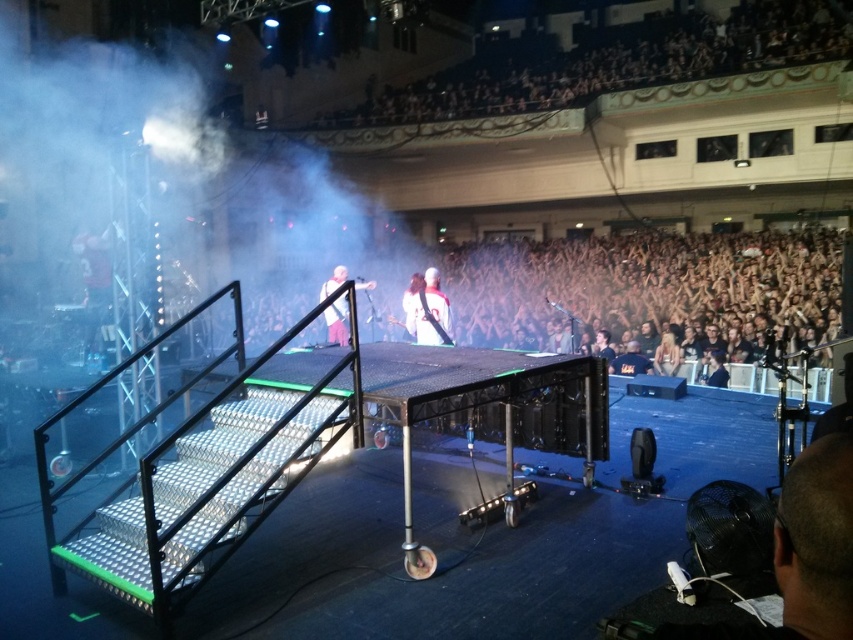
You are a stagehand at the concert and need to position a new spotlight. The spotlight needs to be placed at the exact center of the stage. You have coordinates for a point on the stage. Is the point at (97, 152) the center of the stage?

The white fog at stage center is located at point (97, 152), so yes, the point at (97, 152) is the center of the stage.

You are a stagehand who needs to place a new spotlight on the stage. The spotlight requires a clear vertical space of at least 1.5 meters. Given the presence of the white fog at stage center and the white fabric guitar at center, which object might interfere with the spotlight placement due to its height?

The white fog at stage center is much taller than the white fabric guitar at center, so it might interfere with the spotlight placement due to its height.